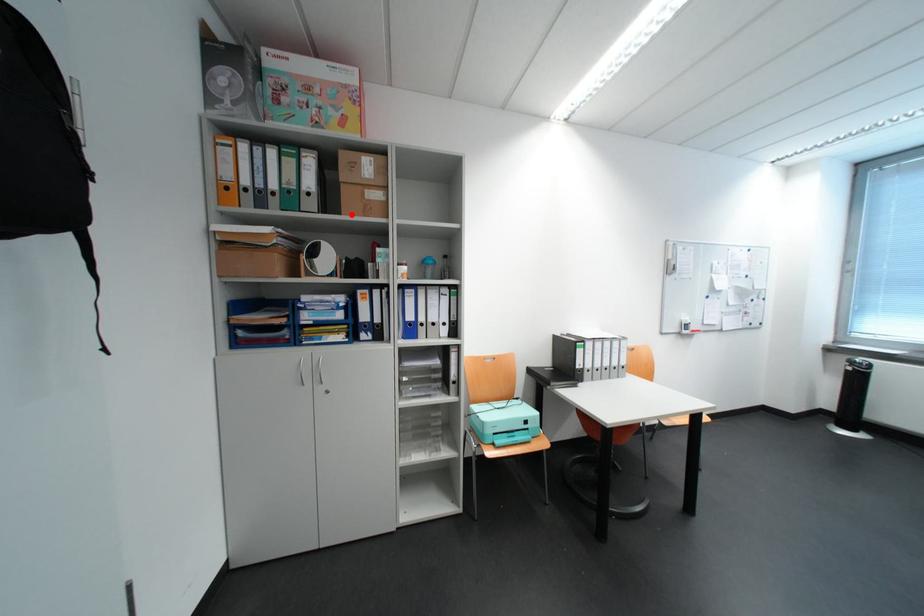
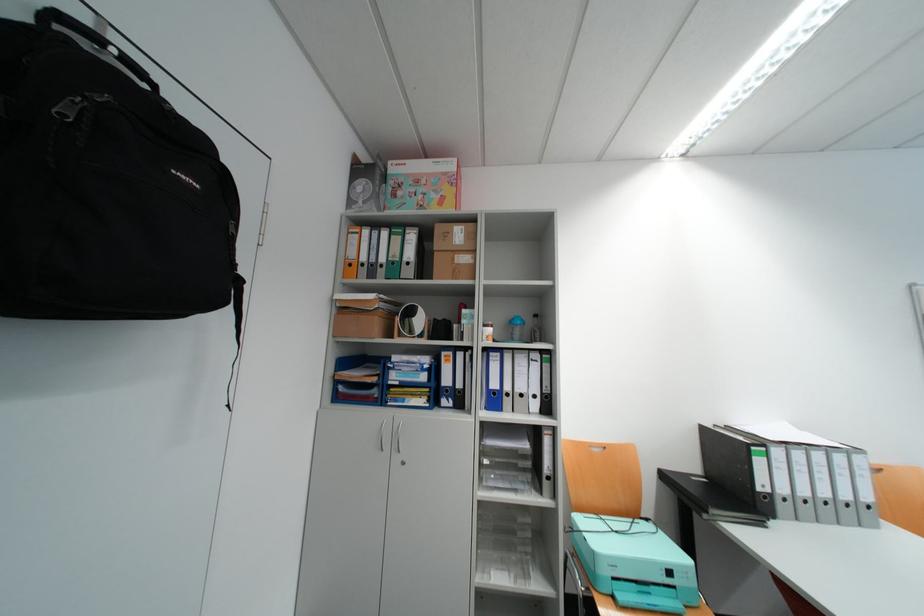
Find the pixel in the second image that matches the highlighted location in the first image.

(444, 280)